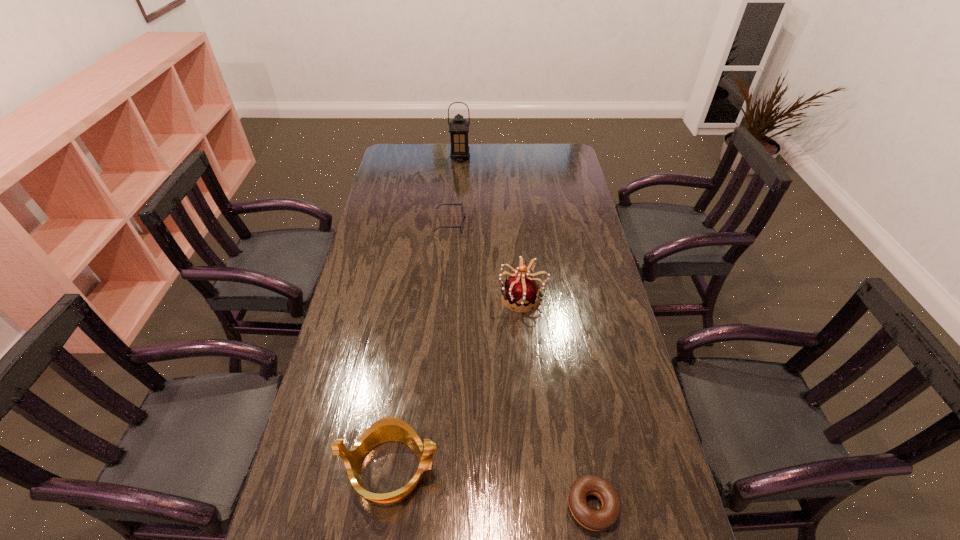
This screenshot has height=540, width=960. I want to click on vacant region located on the front-facing side of the third farthest object, so click(441, 297).

This screenshot has height=540, width=960. In order to click on free spot located on the front-facing side of the third farthest object in this screenshot , I will do `click(462, 297)`.

Find the location of a particular element. The width and height of the screenshot is (960, 540). free location located 0.210m at the front emblem of the nearer tiara is located at coordinates (528, 468).

Identify the location of blank space located on the front-facing side of the second farthest object. This screenshot has height=540, width=960. (530, 224).

The image size is (960, 540). I want to click on blank space located on the left of the doughnut, so click(x=496, y=506).

At what (x,y) coordinates should I click in order to perform the action: click on object situated at the far edge. Please return your answer as a coordinate pair (x, y). This screenshot has width=960, height=540. Looking at the image, I should click on (458, 128).

You are a GUI agent. You are given a task and a screenshot of the screen. Output one action in this format:
    pyautogui.click(x=<x>, y=<y>)
    Task: Click on the object present at the left edge
    
    Given the screenshot: What is the action you would take?
    pyautogui.click(x=386, y=429)

The height and width of the screenshot is (540, 960). Find the location of `object that is positioned at the right edge`. object that is positioned at the right edge is located at coordinates (596, 520).

Locate an element on the screen. The image size is (960, 540). vacant space at the far edge is located at coordinates (513, 160).

Image resolution: width=960 pixels, height=540 pixels. I want to click on free spot at the left edge of the desktop, so click(x=381, y=341).